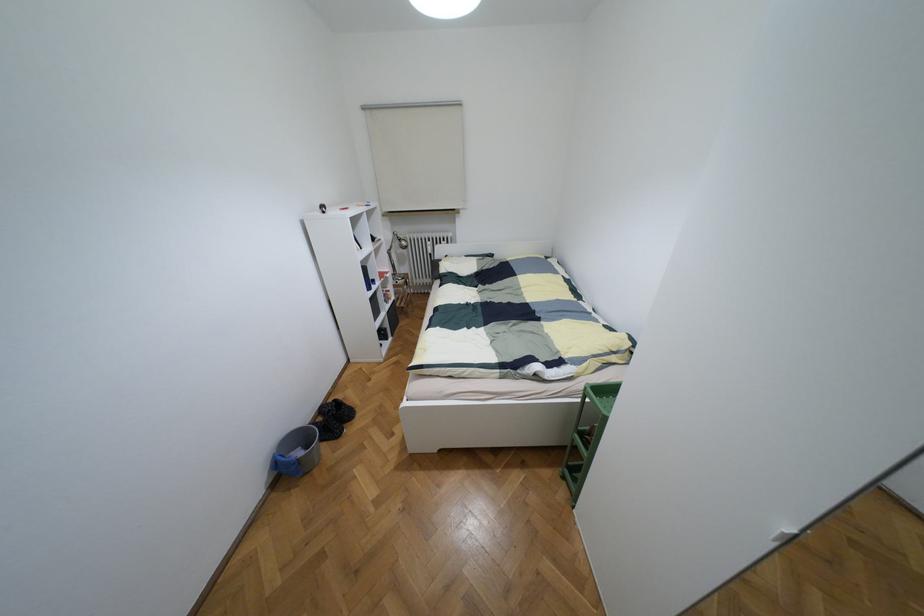
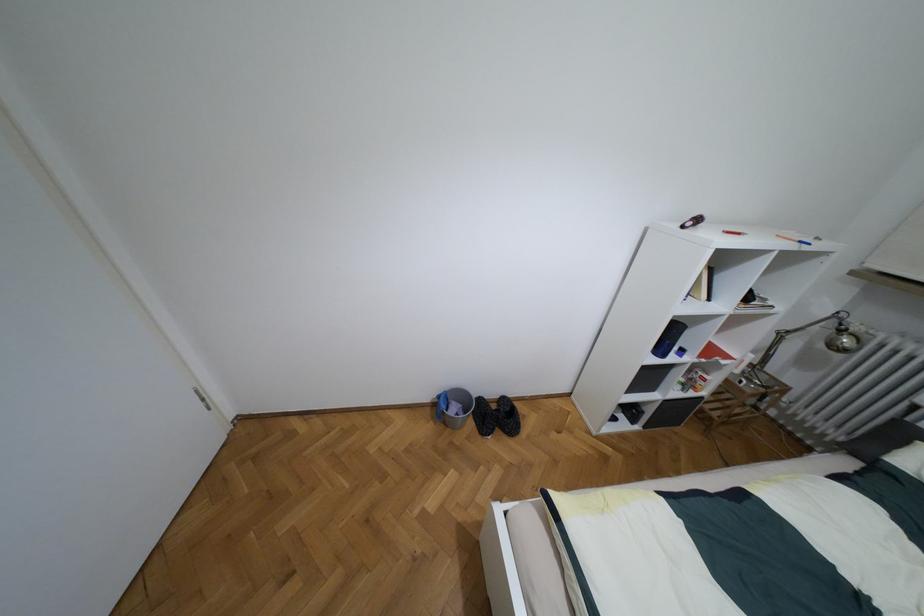
The point at (298, 453) is marked in the first image. Where is the corresponding point in the second image?

(453, 408)